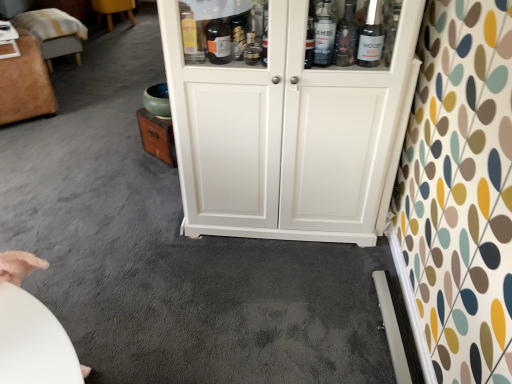
Question: From the image's perspective, does white glossy table at upper left appear higher than white wood cupboard at center?

Choices:
 (A) no
 (B) yes

Answer: (B)

Question: Does white glossy table at upper left have a larger size compared to white wood cupboard at center?

Choices:
 (A) yes
 (B) no

Answer: (B)

Question: Is white glossy table at upper left oriented away from white wood cupboard at center?

Choices:
 (A) yes
 (B) no

Answer: (B)

Question: Considering the relative positions of white glossy table at upper left and white wood cupboard at center in the image provided, is white glossy table at upper left behind white wood cupboard at center?

Choices:
 (A) yes
 (B) no

Answer: (A)

Question: Does white glossy table at upper left contain white wood cupboard at center?

Choices:
 (A) no
 (B) yes

Answer: (A)

Question: Is white glossy table at upper left to the left or to the right of white wood cupboard at center in the image?

Choices:
 (A) left
 (B) right

Answer: (A)

Question: Choose the correct answer: Is white glossy table at upper left inside white wood cupboard at center or outside it?

Choices:
 (A) inside
 (B) outside

Answer: (B)

Question: From the image's perspective, relative to white wood cupboard at center, is white glossy table at upper left above or below?

Choices:
 (A) above
 (B) below

Answer: (A)

Question: Relative to white wood cupboard at center, is white glossy table at upper left in front or behind?

Choices:
 (A) front
 (B) behind

Answer: (B)

Question: Is velvet ottoman at left, marked as the 1th furniture in a front-to-back arrangement, inside the boundaries of white wood cupboard at center, or outside?

Choices:
 (A) inside
 (B) outside

Answer: (B)

Question: Looking at the image, does velvet ottoman at left, which is the third furniture from back to front, seem bigger or smaller compared to white wood cupboard at center?

Choices:
 (A) big
 (B) small

Answer: (A)

Question: Is velvet ottoman at left, which is the third furniture from back to front, to the left or to the right of white wood cupboard at center in the image?

Choices:
 (A) right
 (B) left

Answer: (B)

Question: In terms of width, does velvet ottoman at left, marked as the 1th furniture in a front-to-back arrangement, look wider or thinner when compared to white wood cupboard at center?

Choices:
 (A) thin
 (B) wide

Answer: (B)

Question: From a real-world perspective, is velvet ottoman at upper left, which is the 2th furniture in back-to-front order, above or below velvet ottoman at left, marked as the 1th furniture in a front-to-back arrangement?

Choices:
 (A) below
 (B) above

Answer: (A)

Question: Does point (52, 21) appear closer or farther from the camera than point (32, 97)?

Choices:
 (A) farther
 (B) closer

Answer: (A)